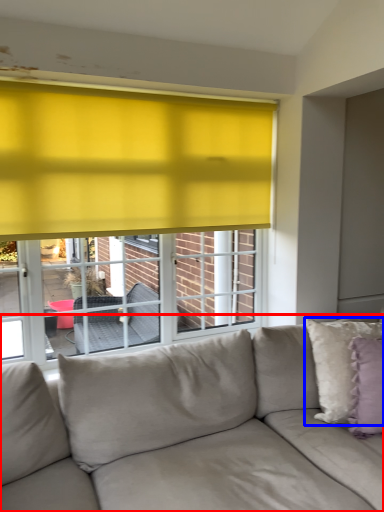
Question: Which of the following is the farthest to the observer, studio couch (highlighted by a red box) or pillow (highlighted by a blue box)?

Choices:
 (A) studio couch
 (B) pillow

Answer: (B)